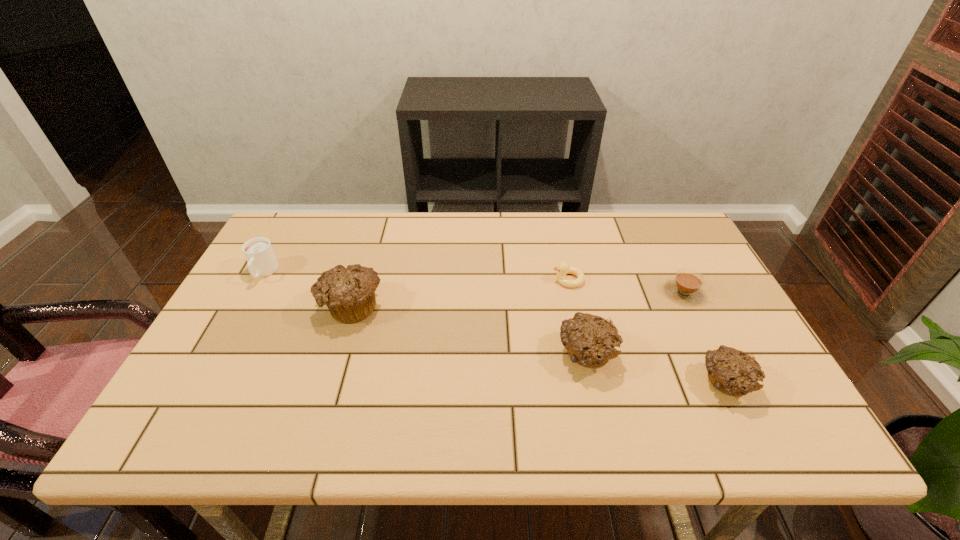
I want to click on the second object from left to right, so click(x=349, y=293).

You are a GUI agent. You are given a task and a screenshot of the screen. Output one action in this format:
    pyautogui.click(x=<x>, y=<y>)
    Task: Click on the leftmost muffin
    This screenshot has height=540, width=960.
    Given the screenshot: What is the action you would take?
    pyautogui.click(x=349, y=293)

Image resolution: width=960 pixels, height=540 pixels. In order to click on the second tallest muffin in this screenshot , I will do (x=589, y=339).

Locate an element on the screen. the shortest muffin is located at coordinates (733, 372).

The height and width of the screenshot is (540, 960). I want to click on the shorter cappuccino, so [686, 287].

This screenshot has height=540, width=960. In order to click on duckling in this screenshot , I will do `click(563, 268)`.

At what (x,y) coordinates should I click in order to perform the action: click on the taller cappuccino. Please return your answer as a coordinate pair (x, y). Looking at the image, I should click on (262, 262).

Identify the location of the left cappuccino. The image size is (960, 540). (262, 262).

Where is `vacant space located on the back of the farthest muffin`? The width and height of the screenshot is (960, 540). vacant space located on the back of the farthest muffin is located at coordinates (370, 242).

You are a GUI agent. You are given a task and a screenshot of the screen. Output one action in this format:
    pyautogui.click(x=<x>, y=<y>)
    Task: Click on the free space located 0.060m on the left of the second shortest muffin
    Image resolution: width=960 pixels, height=540 pixels.
    Given the screenshot: What is the action you would take?
    pyautogui.click(x=533, y=355)